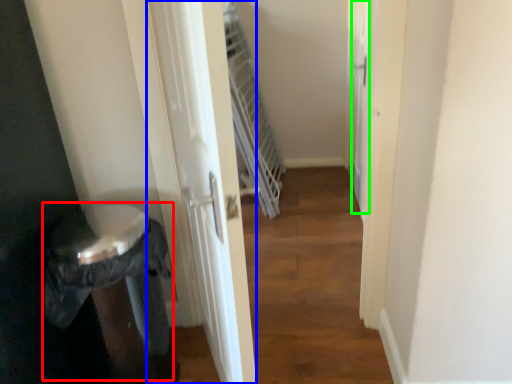
Question: Which object is positioned closest to potty (highlighted by a red box)? Select from screen door (highlighted by a blue box) and screen door (highlighted by a green box).

Choices:
 (A) screen door
 (B) screen door

Answer: (A)